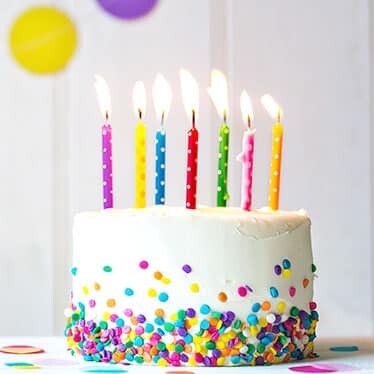
You are a GUI agent. You are given a task and a screenshot of the screen. Output one action in this format:
    pyautogui.click(x=<x>, y=<y>)
    Task: Click on the birthday candles
    
    Given the screenshot: What is the action you would take?
    pyautogui.click(x=104, y=137), pyautogui.click(x=144, y=157), pyautogui.click(x=169, y=167), pyautogui.click(x=196, y=181), pyautogui.click(x=230, y=167), pyautogui.click(x=239, y=186), pyautogui.click(x=273, y=172)